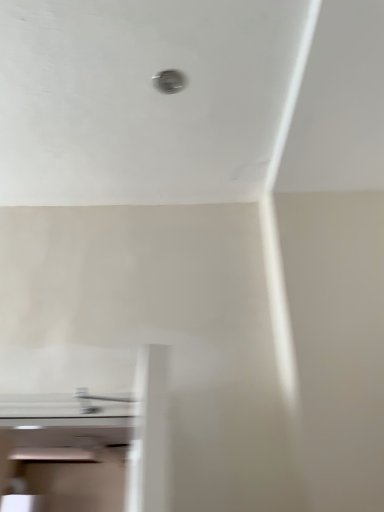
Describe the element at coordinates (96, 400) in the screenshot. I see `satin nickel faucet at lower center` at that location.

Identify the location of satin nickel faucet at lower center. (96, 400).

Measure the distance between point (157,73) and camera.

They are 1.25 meters apart.

What are the coordinates of `metallic circular hole at upper center` in the screenshot? It's located at (169, 81).

Image resolution: width=384 pixels, height=512 pixels. What do you see at coordinates (169, 81) in the screenshot? I see `metallic circular hole at upper center` at bounding box center [169, 81].

Locate an element on the screen. The width and height of the screenshot is (384, 512). satin nickel faucet at lower center is located at coordinates (96, 400).

Is metallic circular hole at upper center to the right of satin nickel faucet at lower center from the viewer's perspective?

Yes, metallic circular hole at upper center is to the right of satin nickel faucet at lower center.

Who is more distant, metallic circular hole at upper center or satin nickel faucet at lower center?

metallic circular hole at upper center is behind.

Is point (162, 81) behind point (80, 389)?

No.

From the image's perspective, is metallic circular hole at upper center over satin nickel faucet at lower center?

Indeed, from the image's perspective, metallic circular hole at upper center is shown above satin nickel faucet at lower center.

From a real-world perspective, is metallic circular hole at upper center physically located above or below satin nickel faucet at lower center?

From a real-world perspective, metallic circular hole at upper center is physically above satin nickel faucet at lower center.

Can you confirm if metallic circular hole at upper center is thinner than satin nickel faucet at lower center?

Yes, metallic circular hole at upper center is thinner than satin nickel faucet at lower center.

Which of these two, metallic circular hole at upper center or satin nickel faucet at lower center, stands taller?

With more height is satin nickel faucet at lower center.

Looking at this image, in terms of size, does metallic circular hole at upper center appear bigger or smaller than satin nickel faucet at lower center?

In the image, metallic circular hole at upper center appears to be smaller than satin nickel faucet at lower center.

Choose the correct answer: Is metallic circular hole at upper center inside satin nickel faucet at lower center or outside it?

metallic circular hole at upper center is located beyond the bounds of satin nickel faucet at lower center.

Would you say metallic circular hole at upper center is a long distance from satin nickel faucet at lower center?

Absolutely, metallic circular hole at upper center is distant from satin nickel faucet at lower center.

Is metallic circular hole at upper center facing towards satin nickel faucet at lower center?

No, metallic circular hole at upper center is not aimed at satin nickel faucet at lower center.

I want to click on hole located behind the satin nickel faucet at lower center, so click(x=169, y=81).

Which object is positioned more to the right, satin nickel faucet at lower center or metallic circular hole at upper center?

metallic circular hole at upper center.

Is satin nickel faucet at lower center further to the viewer compared to metallic circular hole at upper center?

No, satin nickel faucet at lower center is closer to the viewer.

Which point is more forward, (78, 396) or (183, 73)?

Positioned in front is point (183, 73).

From the image's perspective, which one is positioned lower, satin nickel faucet at lower center or metallic circular hole at upper center?

satin nickel faucet at lower center is shown below in the image.

From a real-world perspective, between satin nickel faucet at lower center and metallic circular hole at upper center, who is vertically lower?

satin nickel faucet at lower center.

Considering the relative sizes of satin nickel faucet at lower center and metallic circular hole at upper center in the image provided, is satin nickel faucet at lower center wider than metallic circular hole at upper center?

Yes.

Between satin nickel faucet at lower center and metallic circular hole at upper center, which one has more height?

satin nickel faucet at lower center.

Who is bigger, satin nickel faucet at lower center or metallic circular hole at upper center?

satin nickel faucet at lower center is bigger.

Is satin nickel faucet at lower center not within metallic circular hole at upper center?

Yes, satin nickel faucet at lower center is located beyond the bounds of metallic circular hole at upper center.

Is satin nickel faucet at lower center not close to metallic circular hole at upper center?

Yes, satin nickel faucet at lower center is far from metallic circular hole at upper center.

Looking at this image, could you tell me if satin nickel faucet at lower center is facing metallic circular hole at upper center?

No, satin nickel faucet at lower center is not oriented towards metallic circular hole at upper center.

What's the angular difference between satin nickel faucet at lower center and metallic circular hole at upper center's facing directions?

There is a 98.1-degree angle between the facing directions of satin nickel faucet at lower center and metallic circular hole at upper center.

In order to click on hole that appears on the right of satin nickel faucet at lower center in this screenshot , I will do `click(169, 81)`.

The width and height of the screenshot is (384, 512). I want to click on hole above the satin nickel faucet at lower center (from the image's perspective), so click(169, 81).

Identify the location of tap that appears below the metallic circular hole at upper center (from a real-world perspective). (96, 400).